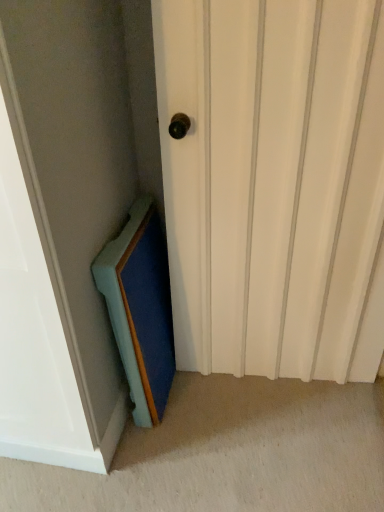
Describe the element at coordinates (274, 184) in the screenshot. I see `white matte door at center` at that location.

Where is `white matte door at center`? Image resolution: width=384 pixels, height=512 pixels. white matte door at center is located at coordinates (274, 184).

What is the approximate height of white matte door at center?

4.16 feet.

The image size is (384, 512). Identify the location of teal wood medicine cabinet at lower left. (140, 308).

What is the approximate width of teal wood medicine cabinet at lower left?

It is 4.36 inches.

What do you see at coordinates (140, 308) in the screenshot?
I see `teal wood medicine cabinet at lower left` at bounding box center [140, 308].

Locate an element on the screen. The height and width of the screenshot is (512, 384). white matte door at center is located at coordinates (274, 184).

Which is more to the right, white matte door at center or teal wood medicine cabinet at lower left?

white matte door at center is more to the right.

Between white matte door at center and teal wood medicine cabinet at lower left, which one is positioned in front?

white matte door at center.

Between point (181, 192) and point (124, 296), which one is positioned in front?

Point (124, 296)

From the image's perspective, relative to teal wood medicine cabinet at lower left, is white matte door at center above or below?

white matte door at center is situated higher than teal wood medicine cabinet at lower left in the image.

From a real-world perspective, is white matte door at center physically located above or below teal wood medicine cabinet at lower left?

white matte door at center is above teal wood medicine cabinet at lower left.

Considering the relative sizes of white matte door at center and teal wood medicine cabinet at lower left in the image provided, is white matte door at center wider than teal wood medicine cabinet at lower left?

Indeed, white matte door at center has a greater width compared to teal wood medicine cabinet at lower left.

Is white matte door at center shorter than teal wood medicine cabinet at lower left?

No.

From the picture: Who is bigger, white matte door at center or teal wood medicine cabinet at lower left?

With larger size is white matte door at center.

Is white matte door at center not inside teal wood medicine cabinet at lower left?

Yes.

Can you see white matte door at center touching teal wood medicine cabinet at lower left?

They are not placed beside each other.

Is white matte door at center aimed at teal wood medicine cabinet at lower left?

No, white matte door at center does not turn towards teal wood medicine cabinet at lower left.

In the scene shown: How distant is white matte door at center from teal wood medicine cabinet at lower left?

white matte door at center is 14.24 inches from teal wood medicine cabinet at lower left.

The height and width of the screenshot is (512, 384). Find the location of `medicine cabinet below the white matte door at center (from the image's perspective)`. medicine cabinet below the white matte door at center (from the image's perspective) is located at coordinates (140, 308).

Based on their positions, is teal wood medicine cabinet at lower left located to the left or right of white matte door at center?

In the image, teal wood medicine cabinet at lower left appears on the left side of white matte door at center.

Is the depth of teal wood medicine cabinet at lower left less than that of white matte door at center?

No, teal wood medicine cabinet at lower left is further to the viewer.

Considering the positions of point (127, 254) and point (333, 48), is point (127, 254) closer or farther from the camera than point (333, 48)?

Point (127, 254) appears to be farther away from the viewer than point (333, 48).

From the image's perspective, is teal wood medicine cabinet at lower left on white matte door at center?

No.

From a real-world perspective, which object rests below the other?

teal wood medicine cabinet at lower left is physically lower.

Between teal wood medicine cabinet at lower left and white matte door at center, which one has larger width?

white matte door at center.

Does teal wood medicine cabinet at lower left have a lesser height compared to white matte door at center?

→ Correct, teal wood medicine cabinet at lower left is not as tall as white matte door at center.

Who is bigger, teal wood medicine cabinet at lower left or white matte door at center?

white matte door at center.

Would you say white matte door at center is part of teal wood medicine cabinet at lower left's contents?

No, white matte door at center is not a part of teal wood medicine cabinet at lower left.

Is teal wood medicine cabinet at lower left in contact with white matte door at center?

There is a gap between teal wood medicine cabinet at lower left and white matte door at center.

Is teal wood medicine cabinet at lower left oriented towards white matte door at center?

Yes, teal wood medicine cabinet at lower left is turned towards white matte door at center.

The image size is (384, 512). Find the location of `door above the teal wood medicine cabinet at lower left (from the image's perspective)`. door above the teal wood medicine cabinet at lower left (from the image's perspective) is located at coordinates (274, 184).

At what (x,y) coordinates should I click in order to perform the action: click on door on the right of teal wood medicine cabinet at lower left. Please return your answer as a coordinate pair (x, y). Looking at the image, I should click on (274, 184).

Locate an element on the screen. door that is above the teal wood medicine cabinet at lower left (from a real-world perspective) is located at coordinates (274, 184).